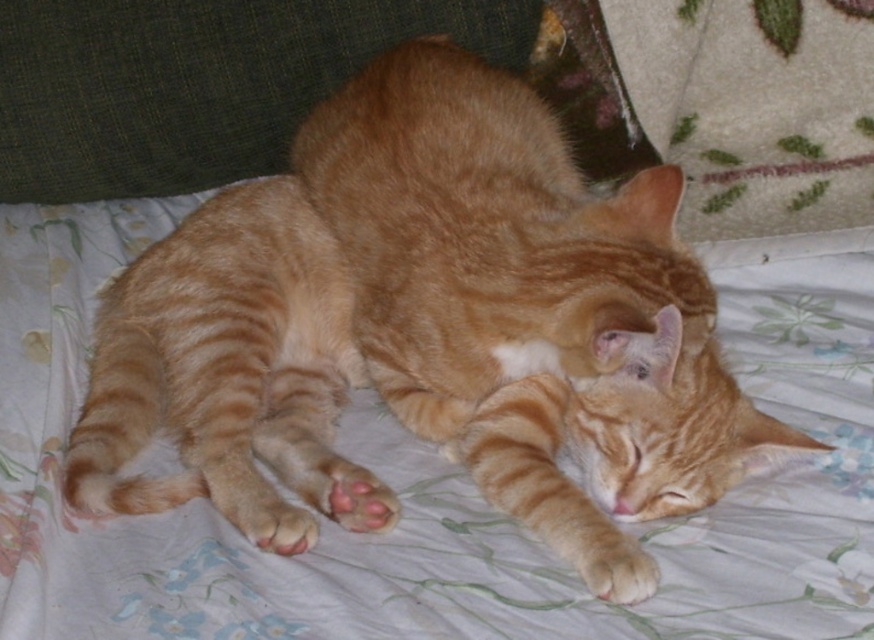
Looking at this image, you are a cat owner who wants to place a small toy between the green fabric pillow at upper left and the orange fur paw at lower center. The toy is 12 inches long. Will the toy fit between them without overlapping either object?

The green fabric pillow at upper left is 23.95 inches away from the orange fur paw at lower center. Since the toy is 12 inches long, which is less than the distance between them, the toy will fit between them without overlapping either object.

You are looking at the image and notice the green fabric pillow at upper left and the orange fur paw at lower center. Which object is positioned more to the left side of the image?

The green fabric pillow at upper left is positioned more to the left side of the image than the orange fur paw at lower center.